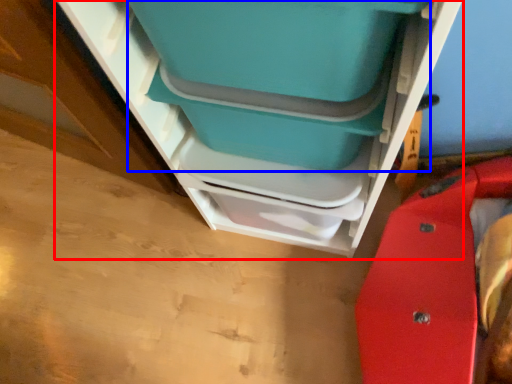
Question: Which object is closer to the camera taking this photo, furniture (highlighted by a red box) or turquoise (highlighted by a blue box)?

Choices:
 (A) furniture
 (B) turquoise

Answer: (A)